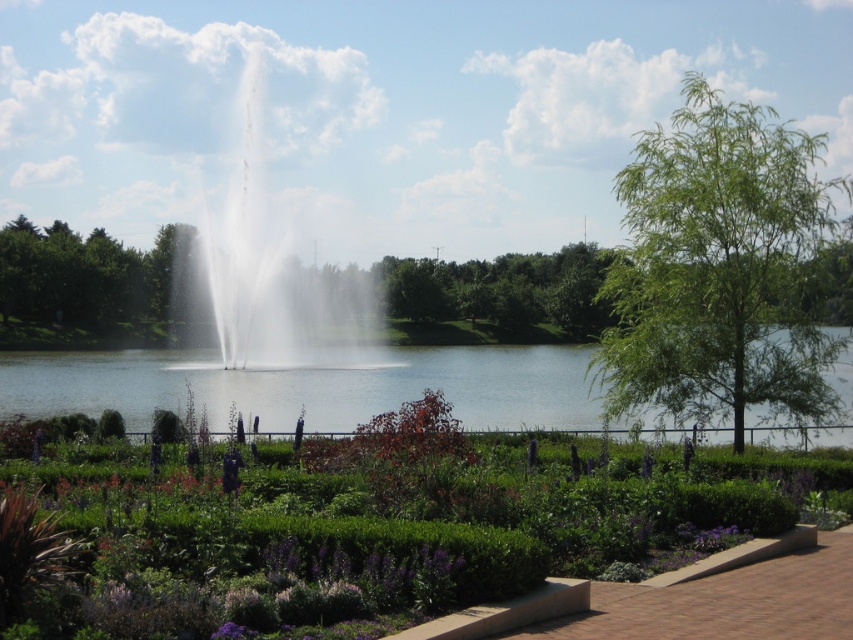
You are standing in the garden and want to take a photo of the clear water at center and the green leafy tree at left. Which object will appear closer to the camera in the photo?

The clear water at center will appear closer to the camera in the photo because it is positioned in front of the green leafy tree at left.

Consider the image. You are standing in the garden and want to walk from the green leafy shrubs at lower center to the clear water at center. Which direction should you move in?

You should move to the left to reach the clear water at center because the green leafy shrubs at lower center is to the right of clear water at center.